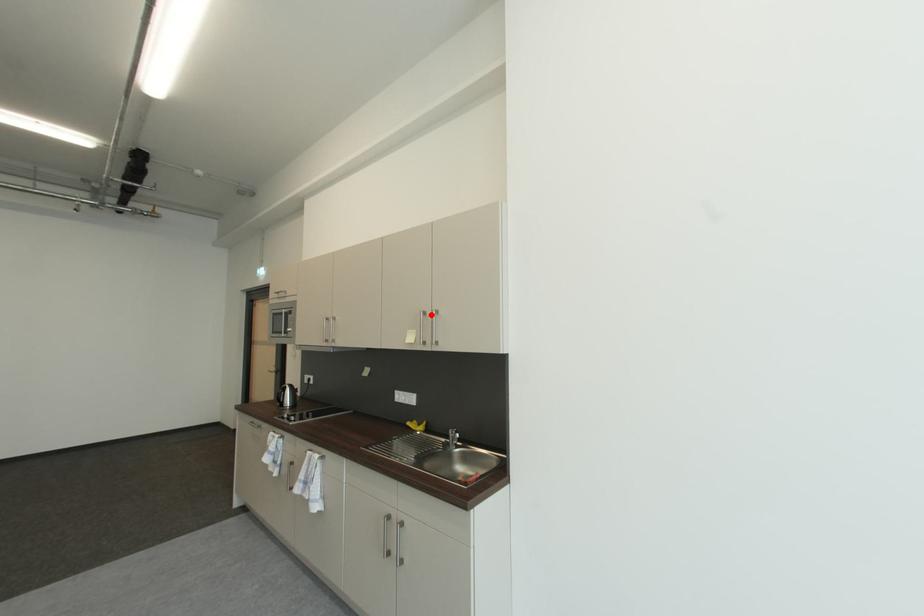
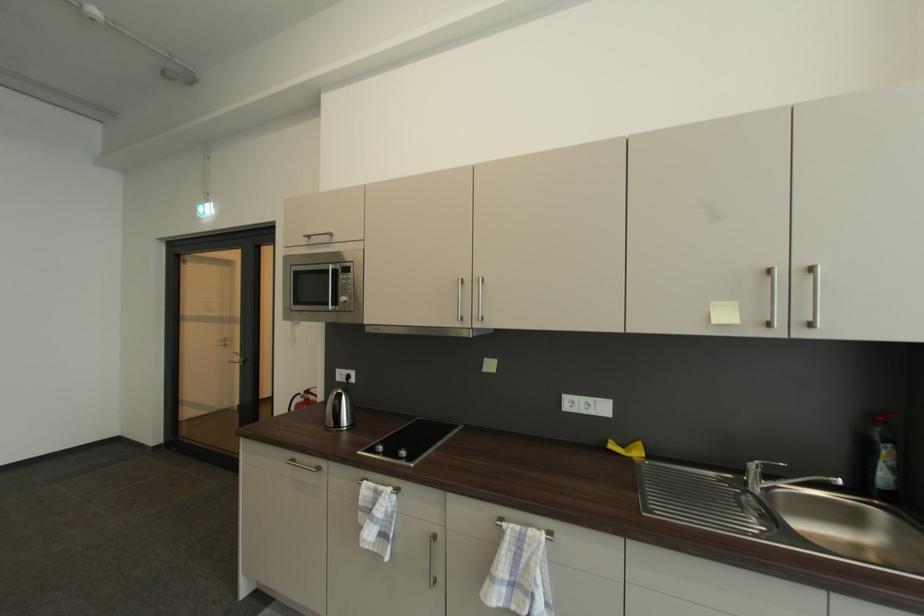
Find the pixel in the second image that matches the highlighted location in the first image.

(774, 272)